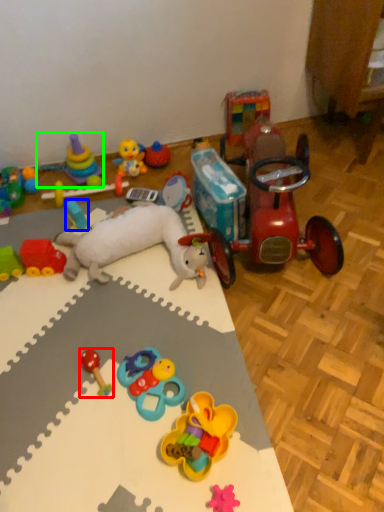
Question: Based on their relative distances, which object is farther from toy (highlighted by a red box)? Choose from toy (highlighted by a blue box) and toy (highlighted by a green box).

Choices:
 (A) toy
 (B) toy

Answer: (B)